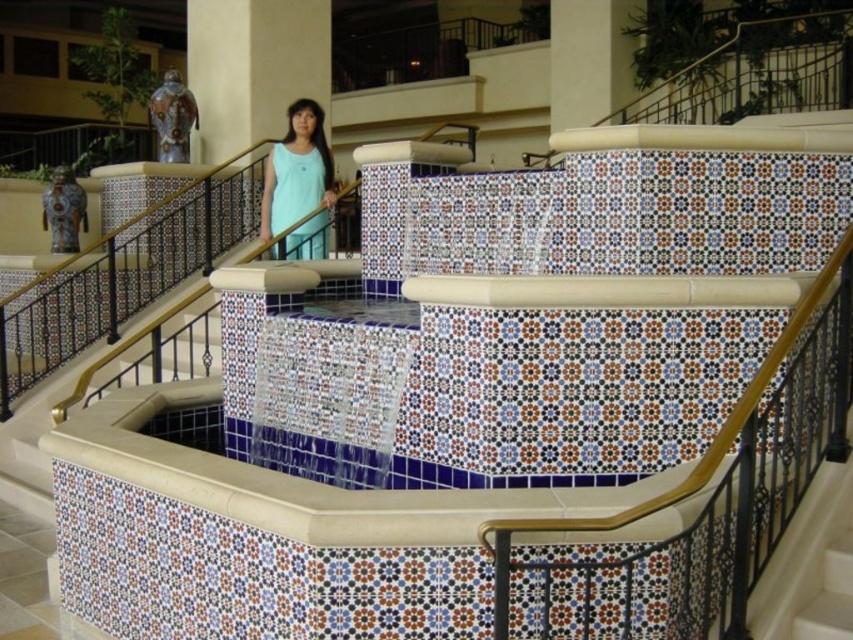
Is matte ceramic vase at upper center above beige marble pillar at upper center?

Incorrect, matte ceramic vase at upper center is not positioned above beige marble pillar at upper center.

Who is positioned more to the left, matte ceramic vase at upper center or beige marble pillar at upper center?

From the viewer's perspective, matte ceramic vase at upper center appears more on the left side.

Between point (286, 49) and point (601, 99), which one is positioned in front?

Point (286, 49)

Find the location of a particular element. matte ceramic vase at upper center is located at coordinates (253, 67).

Which is more to the right, matte ceramic vase at upper center or light blue fabric dress at center?

From the viewer's perspective, light blue fabric dress at center appears more on the right side.

Between matte ceramic vase at upper center and light blue fabric dress at center, which one is positioned lower?

light blue fabric dress at center is lower down.

Locate an element on the screen. Image resolution: width=853 pixels, height=640 pixels. matte ceramic vase at upper center is located at coordinates (253, 67).

The image size is (853, 640). Find the location of `matte ceramic vase at upper center`. matte ceramic vase at upper center is located at coordinates (253, 67).

How far apart are light blue fabric dress at center and beige marble pillar at upper center?

light blue fabric dress at center is 23.10 feet away from beige marble pillar at upper center.

In the scene shown: Between light blue fabric dress at center and beige marble pillar at upper center, which one appears on the left side from the viewer's perspective?

Positioned to the left is light blue fabric dress at center.

Where is `light blue fabric dress at center`? The height and width of the screenshot is (640, 853). light blue fabric dress at center is located at coordinates click(296, 170).

The width and height of the screenshot is (853, 640). What are the coordinates of `light blue fabric dress at center` in the screenshot? It's located at (296, 170).